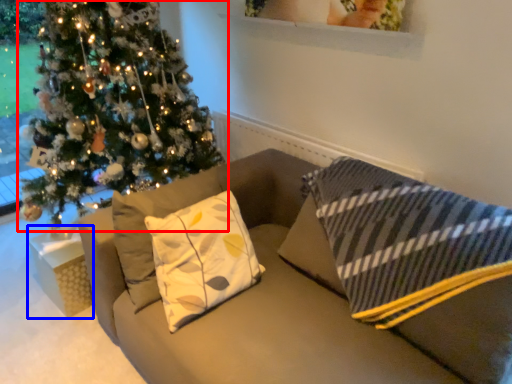
Question: Among these objects, which one is nearest to the camera, christmas tree (highlighted by a red box) or furniture (highlighted by a blue box)?

Choices:
 (A) christmas tree
 (B) furniture

Answer: (A)